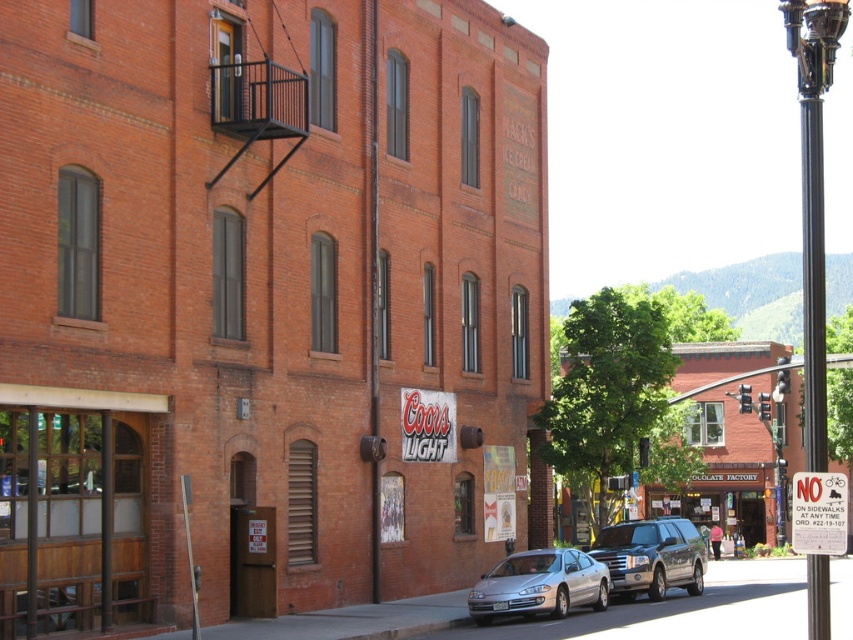
What do you see at coordinates (538, 586) in the screenshot?
I see `silver metallic sedan at center` at bounding box center [538, 586].

Find the location of `silver metallic sedan at center`. silver metallic sedan at center is located at coordinates (x=538, y=586).

Can you confirm if black polished metal pole at right is positioned above white plastic sign at lower right?

Yes.

Is point (820, 216) in front of point (804, 490)?

No, (820, 216) is behind (804, 490).

The image size is (853, 640). I want to click on black polished metal pole at right, so (x=813, y=278).

Is black metal pole at upper right thinner than silver metallic sedan at center?

Incorrect, black metal pole at upper right's width is not less than silver metallic sedan at center's.

Does black metal pole at upper right come behind silver metallic sedan at center?

That is False.

Between point (811, 387) and point (486, 596), which one is positioned in front?

Point (811, 387) is more forward.

You are a GUI agent. You are given a task and a screenshot of the screen. Output one action in this format:
    pyautogui.click(x=<x>, y=<y>)
    Task: Click on the black metal pole at upper right
    
    Given the screenshot: What is the action you would take?
    pyautogui.click(x=813, y=195)